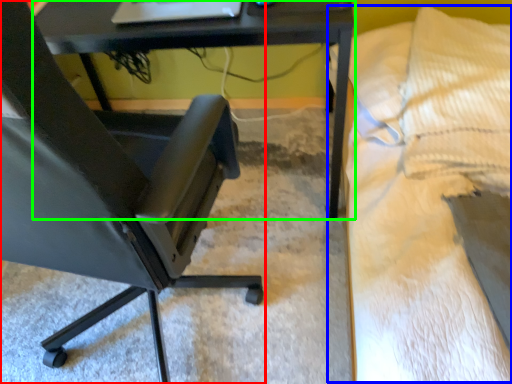
Question: Which object is the closest to the chair (highlighted by a red box)? Choose among these: bed (highlighted by a blue box) or table (highlighted by a green box).

Choices:
 (A) bed
 (B) table

Answer: (B)